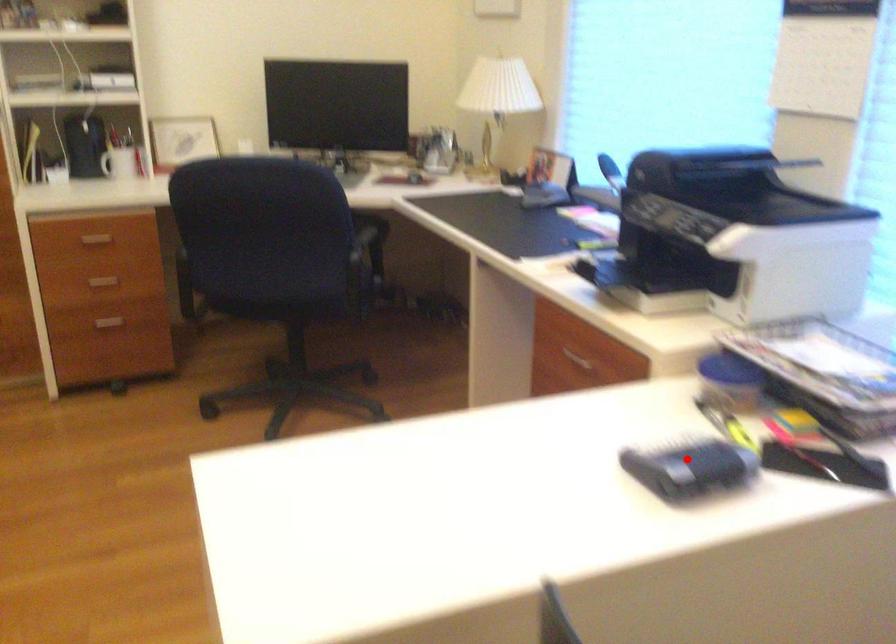
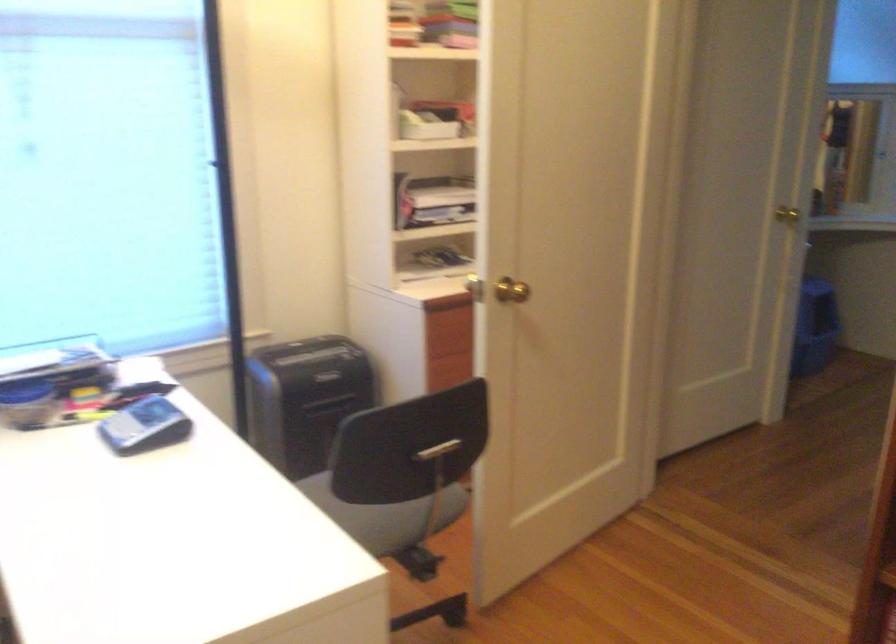
Question: I am providing you with two images of the same scene from different viewpoints. A red point is marked on the first image. Is the red point's position out of view in image 2?

Choices:
 (A) Yes
 (B) No

Answer: (B)